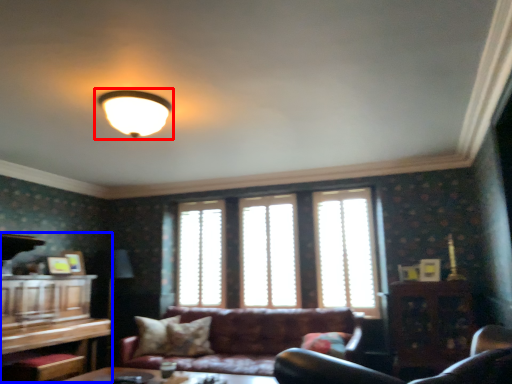
Question: Which point is closer to the camera, lamp (highlighted by a red box) or entertainment center (highlighted by a blue box)?

Choices:
 (A) lamp
 (B) entertainment center

Answer: (A)